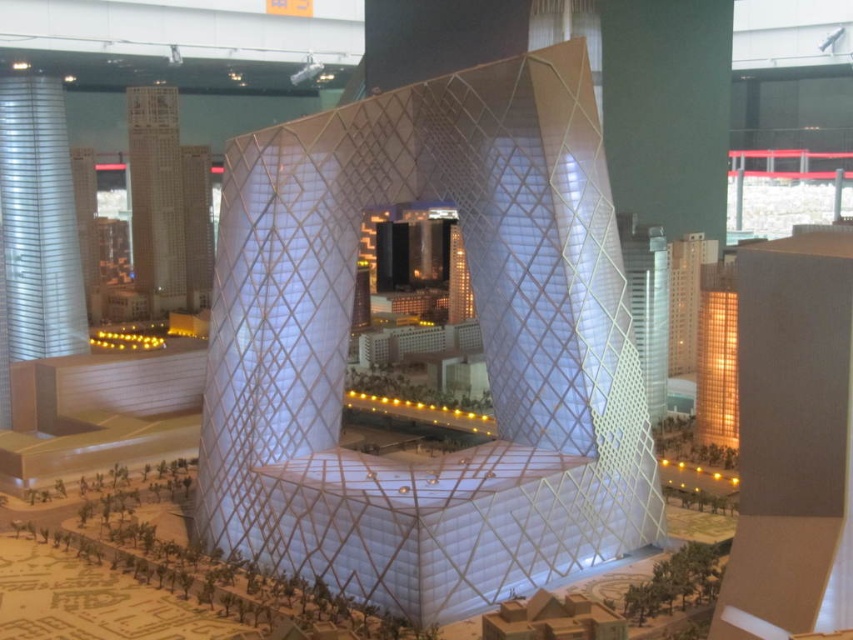
Does white textured building at center have a lesser height compared to white textured building at upper left?

Yes, white textured building at center is shorter than white textured building at upper left.

Who is shorter, white textured building at center or white textured building at upper left?

white textured building at center

Who is more forward, (476, 532) or (158, 100)?

Point (476, 532) is more forward.

This screenshot has width=853, height=640. I want to click on white textured building at center, so click(480, 339).

Who is positioned more to the right, white textured building at center or silver metallic tower at left?

white textured building at center

Is white textured building at center below silver metallic tower at left?

Yes.

Identify the location of white textured building at center. 480,339.

Does white textured building at upper left have a greater height compared to white mesh tower at right?

Indeed, white textured building at upper left has a greater height compared to white mesh tower at right.

Can you confirm if white textured building at upper left is positioned to the right of white mesh tower at right?

In fact, white textured building at upper left is to the left of white mesh tower at right.

Is point (128, 134) in front of point (666, 269)?

No, (128, 134) is behind (666, 269).

Locate an element on the screen. white textured building at upper left is located at coordinates (155, 196).